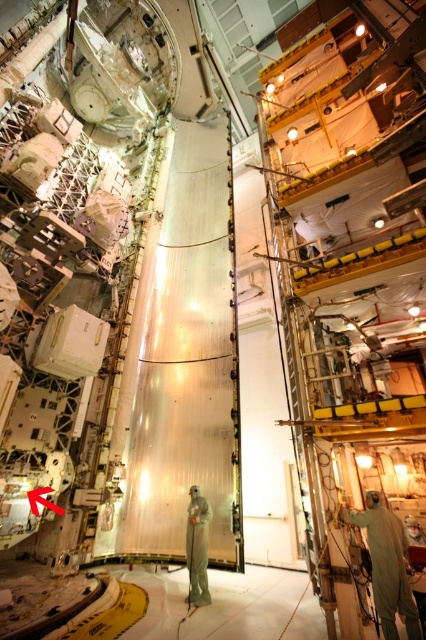
Does light green hazmat suit at right have a smaller size compared to light gray fabric suit at center?

No.

Who is more forward, (385, 509) or (192, 593)?

Positioned in front is point (385, 509).

Where is `light green hazmat suit at right`? The image size is (426, 640). light green hazmat suit at right is located at coordinates (386, 564).